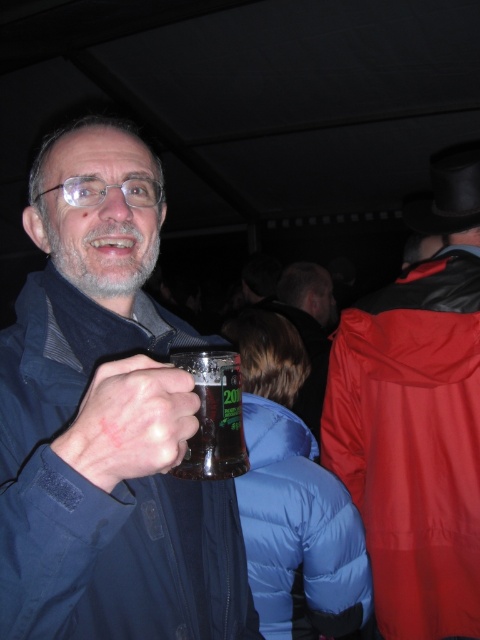
Question: Is the position of red matte jacket at upper right more distant than that of blue puffy jacket at lower center?

Choices:
 (A) no
 (B) yes

Answer: (B)

Question: Which object is farther from the camera taking this photo?

Choices:
 (A) matte black jacket at center
 (B) blue puffy jacket at lower center
 (C) translucent glass mug at center
 (D) red matte jacket at upper right

Answer: (A)

Question: Which of these objects is positioned farthest from the red matte jacket at upper right?

Choices:
 (A) matte plastic mug at center
 (B) matte black jacket at center
 (C) matte glass mug at center
 (D) translucent glass mug at center

Answer: (A)

Question: Can you confirm if blue puffy jacket at lower center is bigger than translucent glass mug at center?

Choices:
 (A) no
 (B) yes

Answer: (B)

Question: Is blue puffy jacket at lower center below matte black jacket at center?

Choices:
 (A) yes
 (B) no

Answer: (A)

Question: Among these objects, which one is nearest to the camera?

Choices:
 (A) matte black jacket at center
 (B) matte plastic mug at center

Answer: (B)